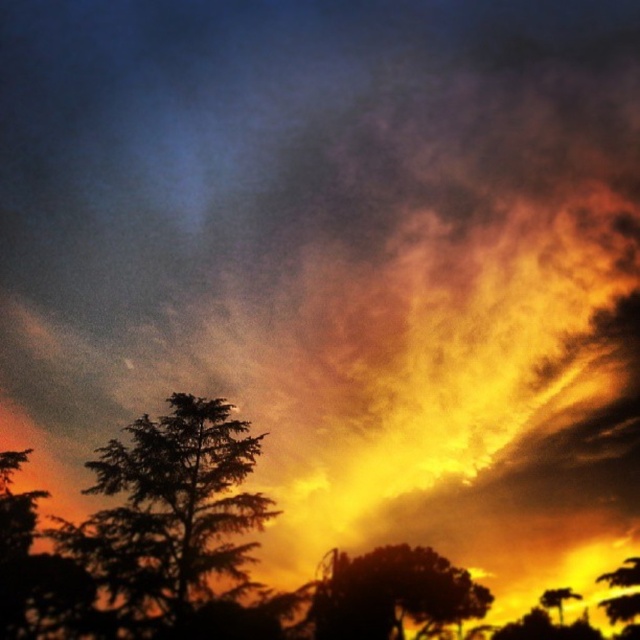
Question: Which point appears farthest from the camera in this image?

Choices:
 (A) (634, 595)
 (B) (156, 506)

Answer: (A)

Question: In this image, where is silhouette leafy tree at center located relative to silky green leafy tree at lower right?

Choices:
 (A) left
 (B) right

Answer: (A)

Question: Which object is farther from the camera taking this photo?

Choices:
 (A) silhouette leafy tree at center
 (B) silky brown tree at lower right
 (C) silky green leafy tree at lower right

Answer: (B)

Question: Does silky brown tree at lower right have a greater width compared to silky green leafy tree at lower right?

Choices:
 (A) no
 (B) yes

Answer: (B)

Question: Does silhouette leafy tree at center lie in front of silky brown tree at lower right?

Choices:
 (A) yes
 (B) no

Answer: (A)

Question: Which of the following is the closest to the observer?

Choices:
 (A) (177, 547)
 (B) (416, 552)
 (C) (628, 576)

Answer: (A)